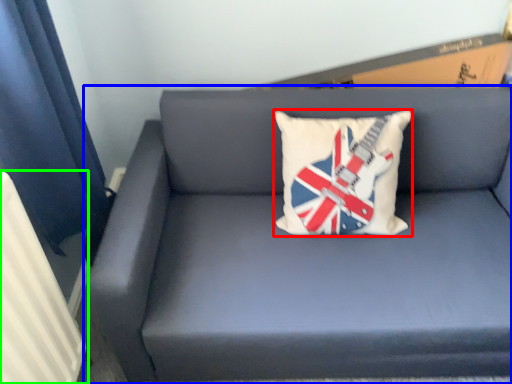
Question: Based on their relative distances, which object is farther from pillow (highlighted by a red box)? Choose from studio couch (highlighted by a blue box) and radiator (highlighted by a green box).

Choices:
 (A) studio couch
 (B) radiator

Answer: (B)